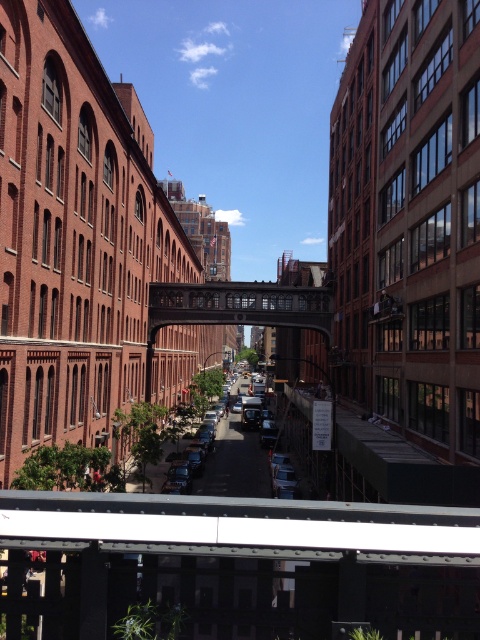
Question: In this image, where is rustic metal bridge at center located relative to shiny silver sedan at center?

Choices:
 (A) left
 (B) right

Answer: (A)

Question: Which of the following is the closest to the observer?

Choices:
 (A) shiny silver sedan at center
 (B) rustic metal bridge at center

Answer: (A)

Question: Can you confirm if rustic metal bridge at center is bigger than shiny silver sedan at center?

Choices:
 (A) yes
 (B) no

Answer: (A)

Question: Does rustic metal bridge at center have a greater width compared to shiny silver sedan at center?

Choices:
 (A) yes
 (B) no

Answer: (A)

Question: Which point is farther from the camera taking this photo?

Choices:
 (A) (207, 461)
 (B) (210, 298)

Answer: (B)